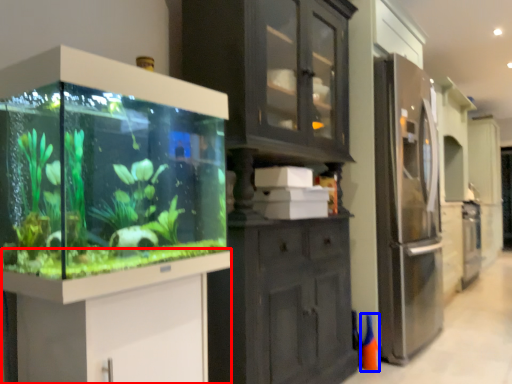
Question: Which object is closer to the camera taking this photo, vanity (highlighted by a red box) or cone (highlighted by a blue box)?

Choices:
 (A) vanity
 (B) cone

Answer: (A)